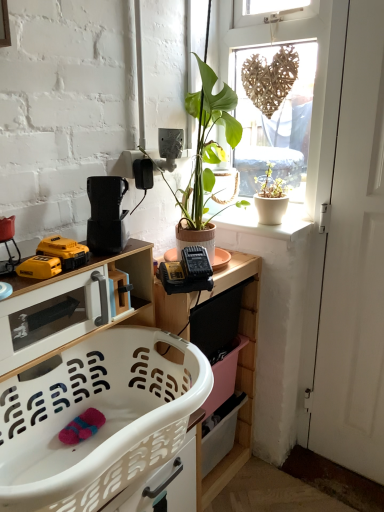
Find the location of a particular element. This screenshot has height=512, width=384. wooden heart at upper right is located at coordinates (315, 75).

In order to face wooden heart at upper right, should I rotate leftwards or rightwards?

Turn right approximately 9.889 degrees to face it.

What is the approximate width of white glossy cabinet at lower left, the 2th cabinetry in the bottom-to-top sequence?

white glossy cabinet at lower left, the 2th cabinetry in the bottom-to-top sequence, is 6.57 inches wide.

This screenshot has height=512, width=384. In order to click on yellow plastic drill at lower left, placed as the 2th toy when sorted from front to back in this screenshot , I will do `click(54, 258)`.

Is yellow plastic drill at lower left, placed as the 2th toy when sorted from front to back, in contact with green matte plant at upper center?

No.

Is yellow plastic drill at lower left, placed as the 2th toy when sorted from front to back, in front of or behind green matte plant at upper center in the image?

yellow plastic drill at lower left, placed as the 2th toy when sorted from front to back, is positioned closer to the viewer than green matte plant at upper center.

Is yellow plastic drill at lower left, placed as the 2th toy when sorted from front to back, oriented away from green matte plant at upper center?

No, yellow plastic drill at lower left, placed as the 2th toy when sorted from front to back, is not facing away from green matte plant at upper center.

Looking at this image, from a real-world perspective, who is located higher, yellow plastic drill at lower left, placed as the 1th toy when sorted from back to front, or green matte plant at upper center?

green matte plant at upper center, from a real-world perspective.

From the image's perspective, between white plastic laundry basket at lower left, arranged as the second cabinetry when viewed from the top, and white matte door at right, who is located below?

white plastic laundry basket at lower left, arranged as the second cabinetry when viewed from the top, appears lower in the image.

Can you see white plastic laundry basket at lower left, arranged as the second cabinetry when viewed from the top, touching white matte door at right?

No, white plastic laundry basket at lower left, arranged as the second cabinetry when viewed from the top, is not in contact with white matte door at right.

Is white plastic laundry basket at lower left, which ranks as the first cabinetry in bottom-to-top order, taller than white matte door at right?

In fact, white plastic laundry basket at lower left, which ranks as the first cabinetry in bottom-to-top order, may be shorter than white matte door at right.

Can you confirm if white plastic laundry basket at lower left, arranged as the second cabinetry when viewed from the top, is thinner than white matte door at right?

In fact, white plastic laundry basket at lower left, arranged as the second cabinetry when viewed from the top, might be wider than white matte door at right.

Consider the image. From the image's perspective, is black plastic coffee maker at upper left located above white glossy cabinet at lower left, the 2th cabinetry in the bottom-to-top sequence?

Yes, from the image's perspective, black plastic coffee maker at upper left is over white glossy cabinet at lower left, the 2th cabinetry in the bottom-to-top sequence.

Considering the sizes of black plastic coffee maker at upper left and white glossy cabinet at lower left, placed as the first cabinetry when sorted from top to bottom, in the image, is black plastic coffee maker at upper left taller or shorter than white glossy cabinet at lower left, placed as the first cabinetry when sorted from top to bottom,?

In the image, black plastic coffee maker at upper left appears to be taller than white glossy cabinet at lower left, placed as the first cabinetry when sorted from top to bottom.

The width and height of the screenshot is (384, 512). What are the coordinates of `the 2nd cabinetry to the left of the black plastic coffee maker at upper left, starting your count from the anchor` in the screenshot? It's located at (70, 304).

Is black plastic coffee maker at upper left further to the viewer compared to white glossy cabinet at lower left, the 2th cabinetry in the bottom-to-top sequence?

Yes, the depth of black plastic coffee maker at upper left is greater than that of white glossy cabinet at lower left, the 2th cabinetry in the bottom-to-top sequence.

Is yellow plastic drill at lower left, the 1th toy from the front, oriented away from wooden heart at upper right?

No.

Is yellow plastic drill at lower left, the second toy viewed from the back, positioned far away from wooden heart at upper right?

Yes.

Which object is thinner, yellow plastic drill at lower left, the 1th toy from the front, or wooden heart at upper right?

yellow plastic drill at lower left, the 1th toy from the front, is thinner.

Considering the relative positions of yellow plastic drill at lower left, the 1th toy from the front, and wooden heart at upper right in the image provided, is yellow plastic drill at lower left, the 1th toy from the front, to the right of wooden heart at upper right from the viewer's perspective?

No.

Considering the sizes of white matte door at right and wooden shelf at center in the image, is white matte door at right bigger or smaller than wooden shelf at center?

Clearly, white matte door at right is smaller in size than wooden shelf at center.

Considering the relative positions of white matte door at right and wooden shelf at center in the image provided, is white matte door at right to the left or to the right of wooden shelf at center?

Clearly, white matte door at right is on the right of wooden shelf at center in the image.

You are a GUI agent. You are given a task and a screenshot of the screen. Output one action in this format:
    pyautogui.click(x=<x>, y=<y>)
    Task: Click on the door above the wooden shelf at center (from the image's perspective)
    The width and height of the screenshot is (384, 512).
    Given the screenshot: What is the action you would take?
    pyautogui.click(x=355, y=263)

Would you say white matte door at right is inside or outside wooden shelf at center?

white matte door at right cannot be found inside wooden shelf at center.

From the image's perspective, is white matte door at right over yellow plastic drill at lower left, placed as the 1th toy when sorted from back to front?

No.

From a real-world perspective, who is located higher, white matte door at right or yellow plastic drill at lower left, placed as the 2th toy when sorted from front to back?

yellow plastic drill at lower left, placed as the 2th toy when sorted from front to back.

Which of these two, green matte plant at upper center or yellow plastic drill at lower left, placed as the 1th toy when sorted from back to front, is bigger?

green matte plant at upper center.

Is green matte plant at upper center spatially inside yellow plastic drill at lower left, placed as the 1th toy when sorted from back to front, or outside of it?

The correct answer is: outside.

Is green matte plant at upper center in contact with yellow plastic drill at lower left, placed as the 1th toy when sorted from back to front?

No, green matte plant at upper center is not touching yellow plastic drill at lower left, placed as the 1th toy when sorted from back to front.

From the picture: Can you tell me how much green matte plant at upper center and yellow plastic drill at lower left, placed as the 1th toy when sorted from back to front, differ in facing direction?

0.365 degrees separate the facing orientations of green matte plant at upper center and yellow plastic drill at lower left, placed as the 1th toy when sorted from back to front.

The height and width of the screenshot is (512, 384). I want to click on toy that is the 1st object located below the green matte plant at upper center (from the image's perspective), so click(54, 258).

The height and width of the screenshot is (512, 384). I want to click on door to the right of white plastic laundry basket at lower left, arranged as the second cabinetry when viewed from the top, so click(355, 263).

Estimate the real-world distances between objects in this image. Which object is further from black plastic coffee maker at upper left, wooden shelf at center or wooden heart at upper right?

wooden heart at upper right is further to black plastic coffee maker at upper left.

Looking at the image, which one is located closer to yellow plastic drill at lower left, placed as the 1th toy when sorted from back to front, yellow plastic drill at lower left, the second toy viewed from the back, or green matte plant at upper center?

Among the two, yellow plastic drill at lower left, the second toy viewed from the back, is located nearer to yellow plastic drill at lower left, placed as the 1th toy when sorted from back to front.

Looking at the image, which one is located closer to white matte door at right, wooden shelf at center or black plastic coffee maker at upper left?

wooden shelf at center lies closer to white matte door at right than the other object.

Based on their spatial positions, is black plastic coffee maker at upper left or wooden shelf at center further from green matte plant at upper center?

black plastic coffee maker at upper left lies further to green matte plant at upper center than the other object.

Which object lies further to the anchor point white glossy cabinet at lower left, the 2th cabinetry in the bottom-to-top sequence, green matte plant at upper center or black plastic coffee maker at upper left?

Based on the image, green matte plant at upper center appears to be further to white glossy cabinet at lower left, the 2th cabinetry in the bottom-to-top sequence.

Based on their spatial positions, is white plastic laundry basket at lower left, which ranks as the first cabinetry in bottom-to-top order, or green matte plant at upper center closer to wooden heart at upper right?

green matte plant at upper center.

Looking at the image, which one is located further to yellow plastic drill at lower left, placed as the 1th toy when sorted from back to front, wooden shelf at center or black plastic coffee maker at upper left?

Among the two, wooden shelf at center is located further to yellow plastic drill at lower left, placed as the 1th toy when sorted from back to front.

Estimate the real-world distances between objects in this image. Which object is further from wooden shelf at center, wooden heart at upper right or black plastic coffee maker at upper left?

wooden heart at upper right lies further to wooden shelf at center than the other object.

You are a GUI agent. You are given a task and a screenshot of the screen. Output one action in this format:
    pyautogui.click(x=<x>, y=<y>)
    Task: Click on the toy between green matte plant at upper center and yellow plastic drill at lower left, the 1th toy from the front, vertically
    The height and width of the screenshot is (512, 384).
    Given the screenshot: What is the action you would take?
    54,258

This screenshot has width=384, height=512. Identify the location of shelf between green matte plant at upper center and white plastic laundry basket at lower left, which ranks as the first cabinetry in bottom-to-top order, from top to bottom. (237, 371).

Where is `appliance between green matte plant at upper center and yellow plastic drill at lower left, the second toy viewed from the back, in the vertical direction`? appliance between green matte plant at upper center and yellow plastic drill at lower left, the second toy viewed from the back, in the vertical direction is located at coordinates (106, 214).

Image resolution: width=384 pixels, height=512 pixels. Find the location of `houseplant between black plastic coffee maker at upper left and white matte door at right`. houseplant between black plastic coffee maker at upper left and white matte door at right is located at coordinates (206, 147).